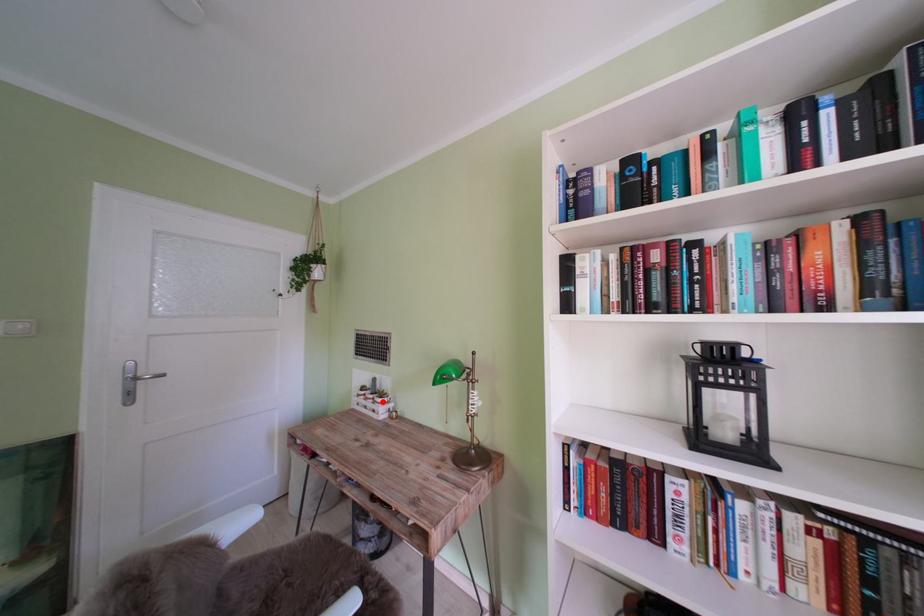
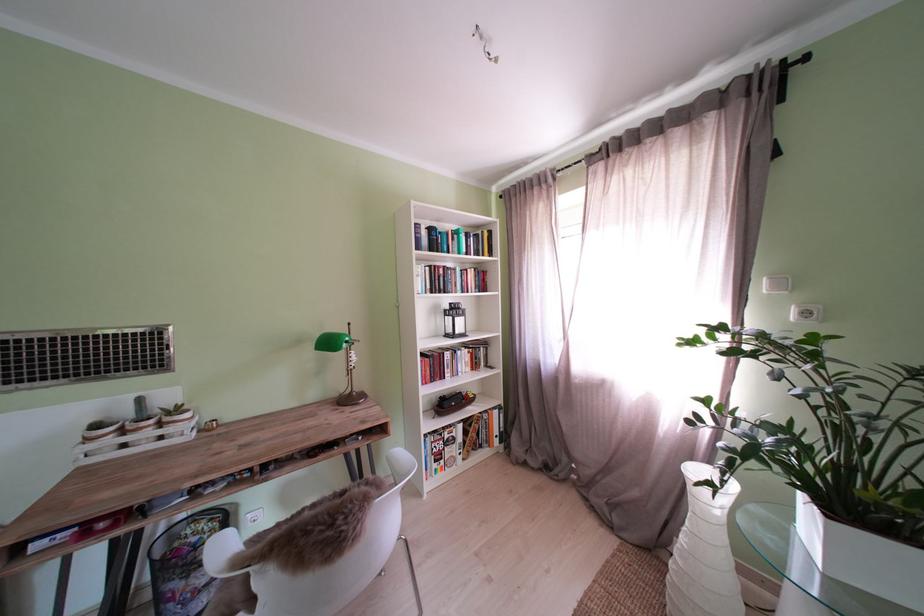
Question: I am providing you with two images of the same scene from different viewpoints. Given a red point in image1, look at the same physical point in image2. Is it:

Choices:
 (A) Closer to the viewpoint
 (B) Farther from the viewpoint

Answer: (A)